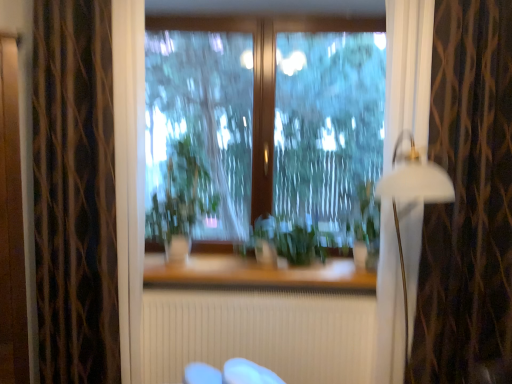
Question: Is transparent glass window at center wider than green leafy plant at center, acting as the first plant starting from the left?

Choices:
 (A) no
 (B) yes

Answer: (A)

Question: From the image's perspective, is transparent glass window at center over green leafy plant at center, acting as the first plant starting from the left?

Choices:
 (A) no
 (B) yes

Answer: (B)

Question: Is transparent glass window at center outside green leafy plant at center, acting as the first plant starting from the left?

Choices:
 (A) no
 (B) yes

Answer: (B)

Question: Is transparent glass window at center positioned in front of green leafy plant at center, acting as the first plant starting from the left?

Choices:
 (A) yes
 (B) no

Answer: (B)

Question: From the image's perspective, is transparent glass window at center beneath green leafy plant at center, which is the 2th plant from right to left?

Choices:
 (A) no
 (B) yes

Answer: (A)

Question: Would you say brown textured curtain at right, the 1th curtain when ordered from right to left, is inside or outside transparent glass window at center?

Choices:
 (A) outside
 (B) inside

Answer: (A)

Question: From a real-world perspective, is brown textured curtain at right, the 1th curtain when ordered from right to left, above or below transparent glass window at center?

Choices:
 (A) below
 (B) above

Answer: (A)

Question: Is brown textured curtain at right, which is the second curtain from left to right, bigger or smaller than transparent glass window at center?

Choices:
 (A) big
 (B) small

Answer: (A)

Question: Considering the positions of brown textured curtain at right, the 1th curtain when ordered from right to left, and transparent glass window at center in the image, is brown textured curtain at right, the 1th curtain when ordered from right to left, wider or thinner than transparent glass window at center?

Choices:
 (A) thin
 (B) wide

Answer: (B)

Question: Considering the relative positions of white textured radiator at center and transparent glass window at center in the image provided, is white textured radiator at center to the left or to the right of transparent glass window at center?

Choices:
 (A) left
 (B) right

Answer: (A)

Question: From the image's perspective, is white textured radiator at center located above or below transparent glass window at center?

Choices:
 (A) above
 (B) below

Answer: (B)

Question: Looking at their shapes, would you say white textured radiator at center is wider or thinner than transparent glass window at center?

Choices:
 (A) wide
 (B) thin

Answer: (B)

Question: From a real-world perspective, is white textured radiator at center positioned above or below transparent glass window at center?

Choices:
 (A) above
 (B) below

Answer: (B)

Question: Is white matte lamp at right to the left or to the right of transparent glass window at center in the image?

Choices:
 (A) right
 (B) left

Answer: (A)

Question: Is white matte lamp at right inside or outside of transparent glass window at center?

Choices:
 (A) inside
 (B) outside

Answer: (B)